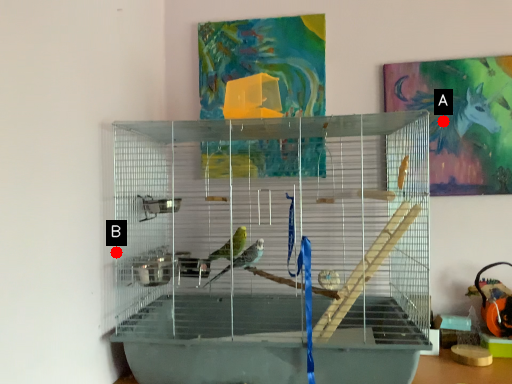
Question: Two points are circled on the image, labeled by A and B beside each circle. Which point is closer to the camera?

Choices:
 (A) A is closer
 (B) B is closer

Answer: (B)